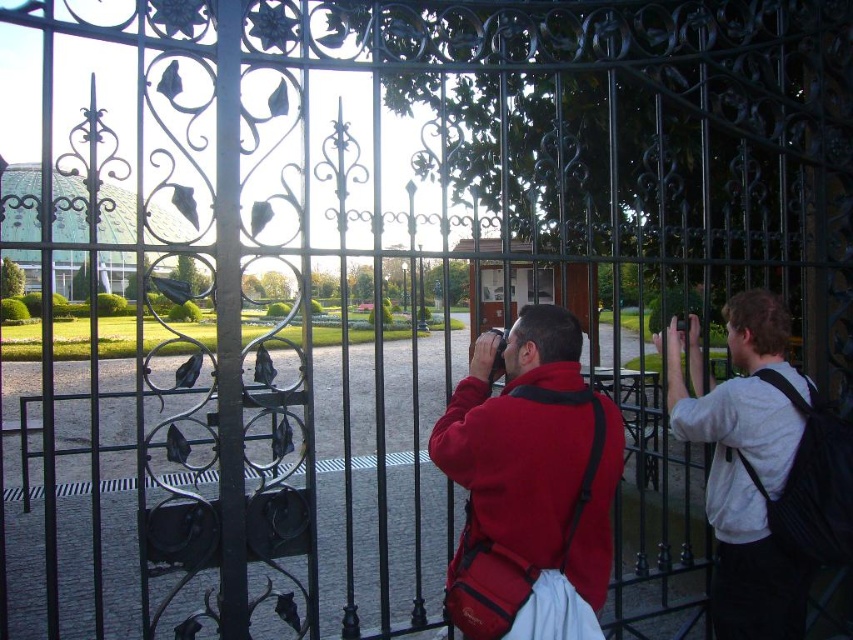
You are standing at the entrance of the botanical garden looking through the wrought iron gates. You notice two points marked in the scene. Which of the two points, point (572,554) or point (534,276), is closer to you?

Point (572,554) is closer to the viewer than point (534,276).

You are a photographer standing at the entrance of the botanical garden. You notice the matte red jacket at center and the metallic glass door at center in your view. If your camera has a maximum zoom range of 10 meters, can you capture both objects in a single photo without moving?

The matte red jacket at center and the metallic glass door at center are 10.45 meters apart. Since the maximum zoom range is 10 meters, the distance between them exceeds the camera capability, so you cannot capture both in a single photo without moving.

You are a visitor at the botanical garden and want to enter through the entrance. You see the matte red jacket at center and the metallic glass door at center. Which object is closer to you as you stand outside the gate?

The matte red jacket at center is closer to you because it is in front of the metallic glass door at center.